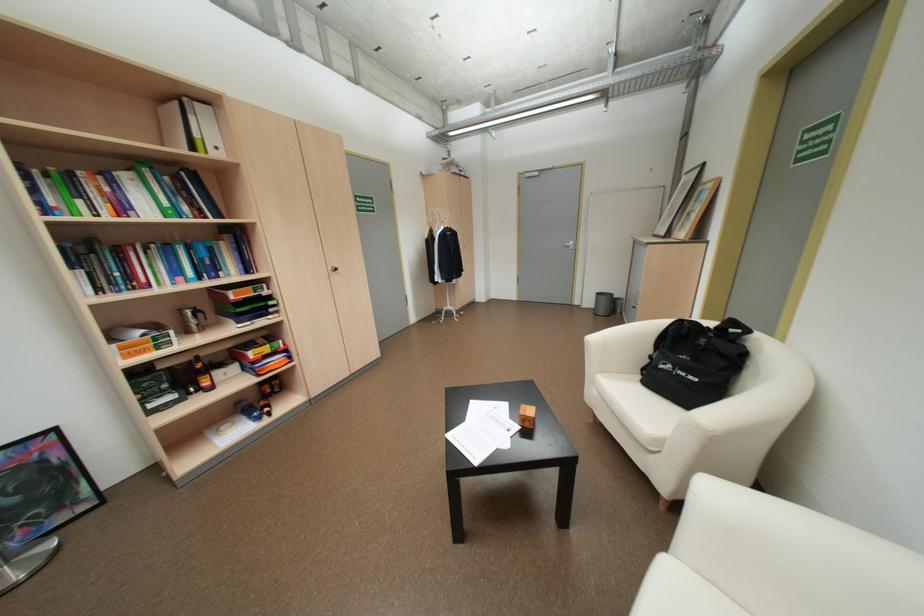
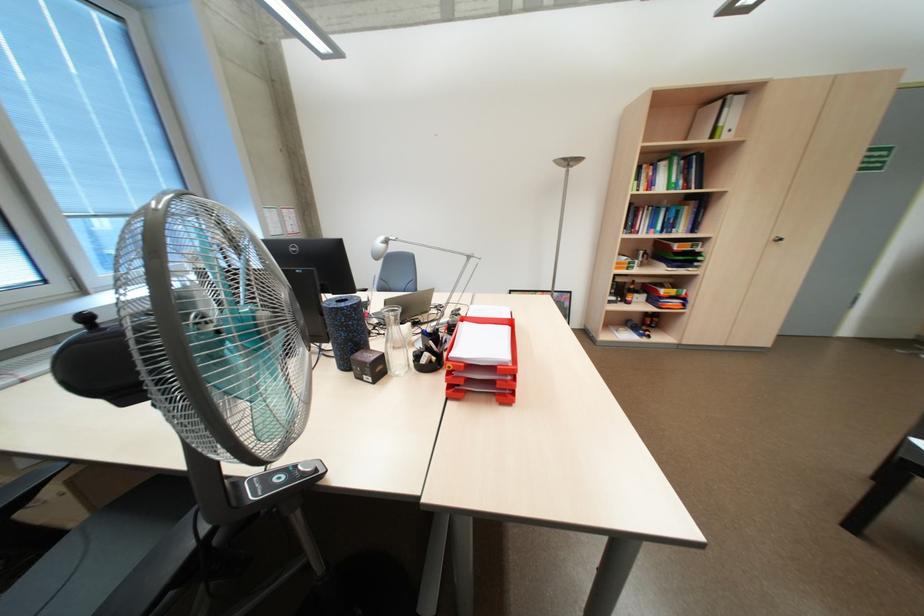
In the second image, find the point that corresponds to [275,349] in the first image.

(683, 291)